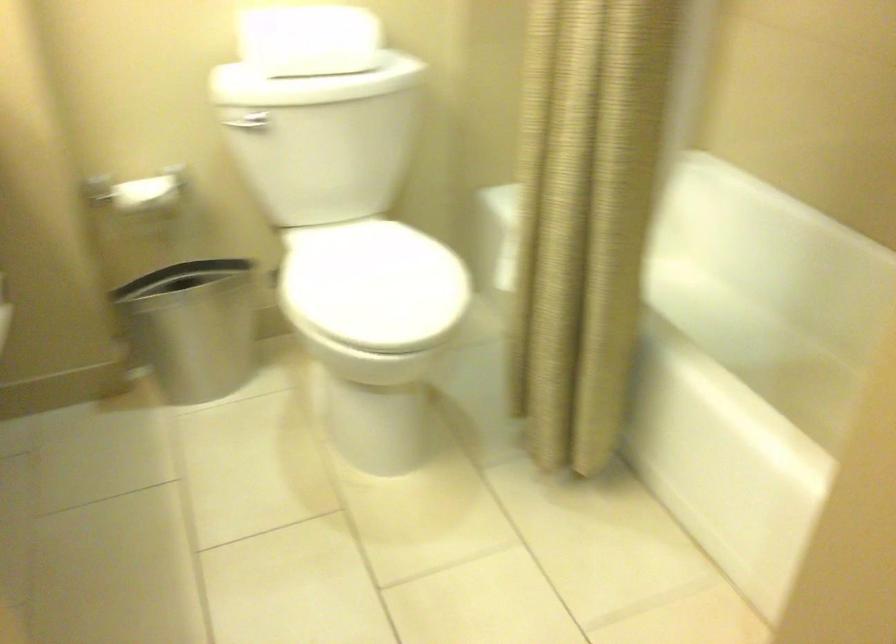
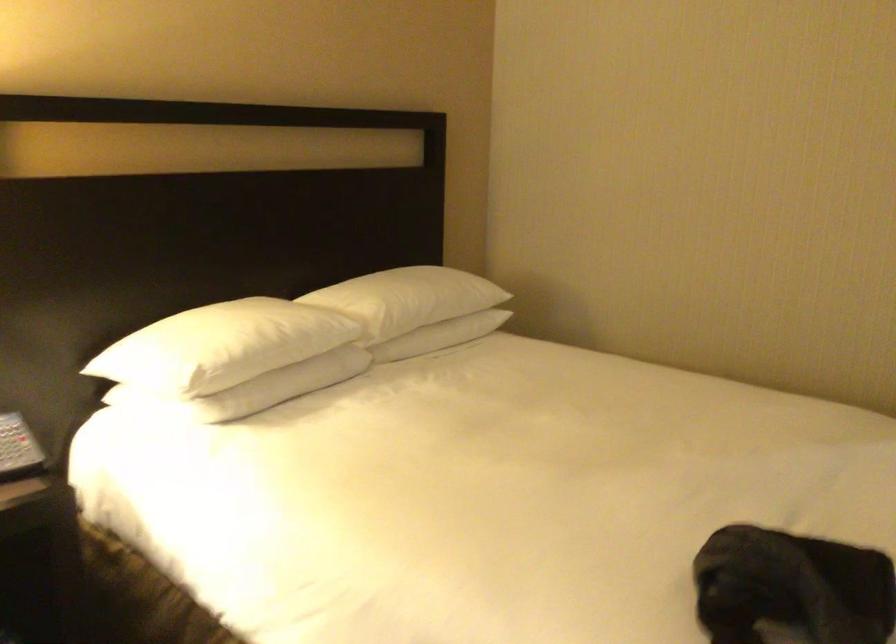
Question: I am providing you with two images of the same scene from different viewpoints. After the viewpoint changes to image2, which objects are now occluded?

Choices:
 (A) white pillow
 (B) telephone handset
 (C) wire mesh basket
 (D) toilet flush lever

Answer: (D)